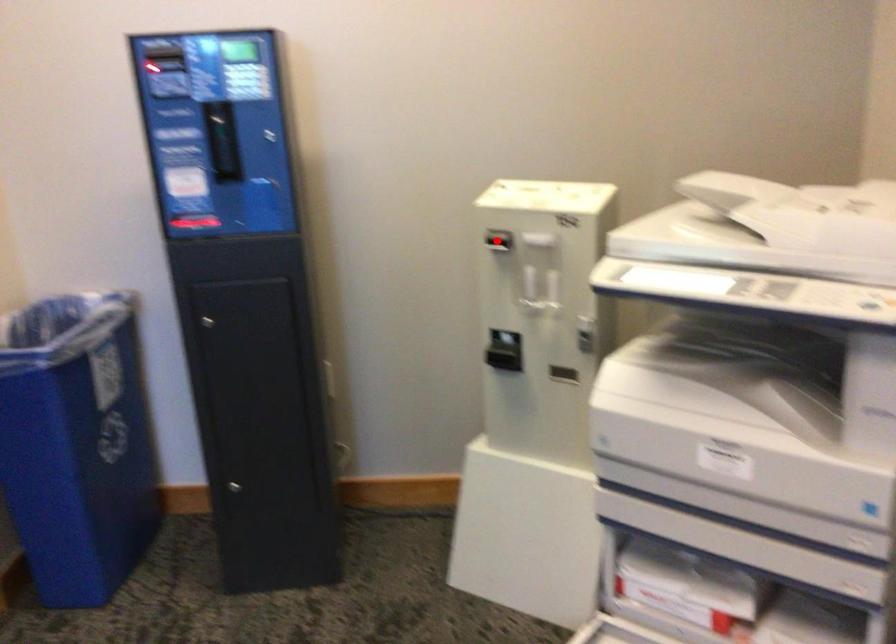
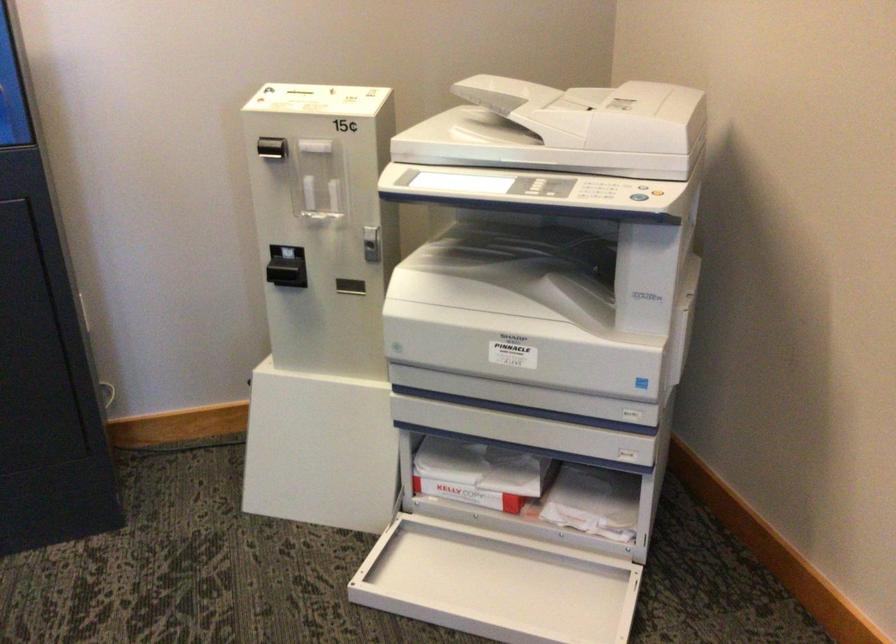
Locate, in the second image, the point that corresponds to the highlighted location in the first image.

(271, 147)